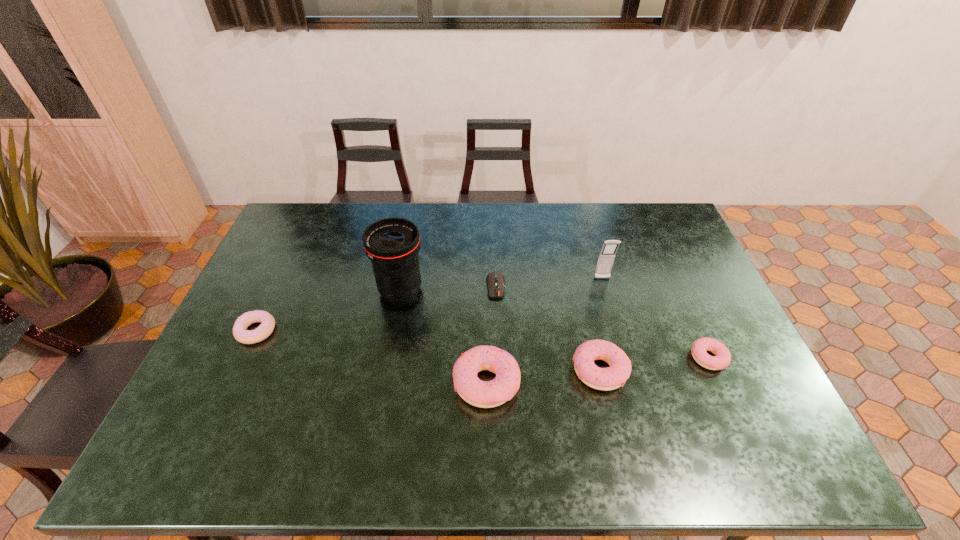
The image size is (960, 540). Find the location of `free point that satisfies the following two spatial constraints: 1. on the button of the third shortest doughnut; 2. on the right side of the computer equipment`. free point that satisfies the following two spatial constraints: 1. on the button of the third shortest doughnut; 2. on the right side of the computer equipment is located at coordinates (499, 370).

The height and width of the screenshot is (540, 960). What are the coordinates of `vacant position in the image that satisfies the following two spatial constraints: 1. on the front-facing side of the rightmost doughnut; 2. on the right side of the cellular telephone` in the screenshot? It's located at (625, 358).